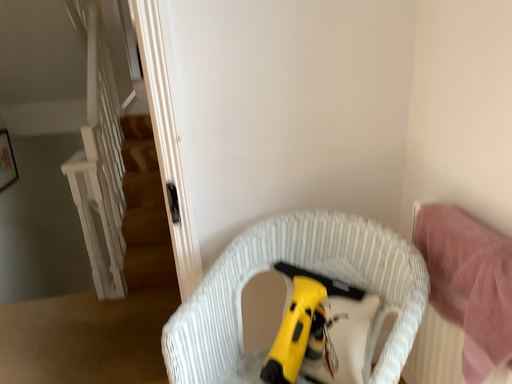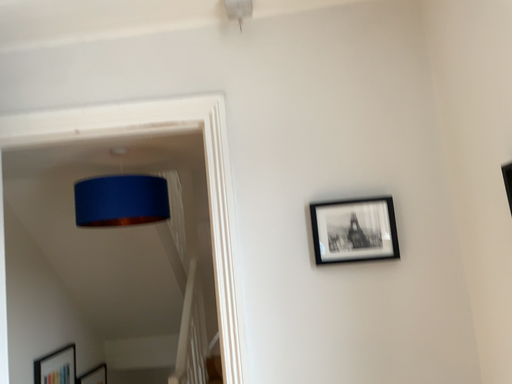
Question: How did the camera likely rotate when shooting the video?

Choices:
 (A) rotated upward
 (B) rotated downward

Answer: (A)